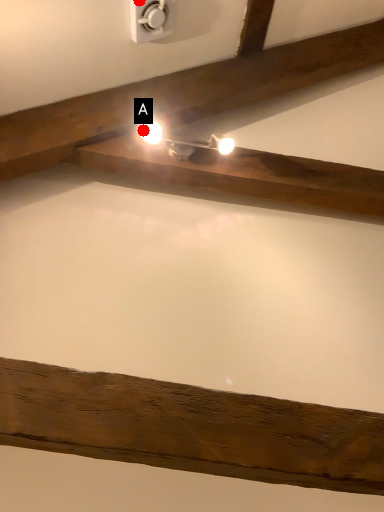
Question: Two points are circled on the image, labeled by A and B beside each circle. Which point is closer to the camera?

Choices:
 (A) A is closer
 (B) B is closer

Answer: (B)